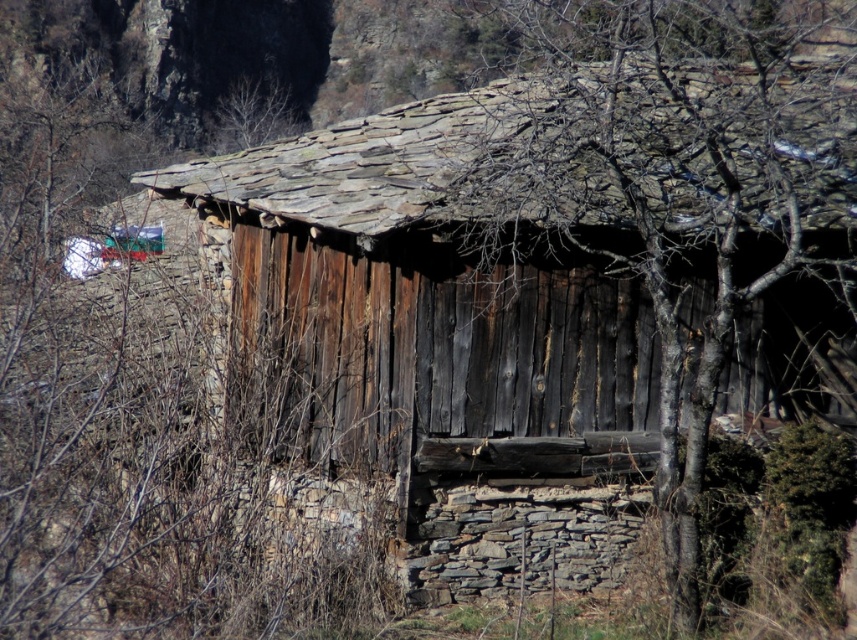
Who is more forward, (166,520) or (852,388)?

Point (166,520)

Which is above, brown rough bark tree at upper left or brown rough bark tree at center?

Positioned higher is brown rough bark tree at center.

Is point (211, 355) positioned after point (667, 145)?

Yes, point (211, 355) is farther from viewer.

Identify the location of brown rough bark tree at upper left. (135, 440).

Does brown rough bark tree at center have a larger size compared to bare branches at upper center?

Correct, brown rough bark tree at center is larger in size than bare branches at upper center.

Is brown rough bark tree at center taller than bare branches at upper center?

Correct, brown rough bark tree at center is much taller as bare branches at upper center.

Does point (519, 182) come closer to viewer compared to point (208, 150)?

That is True.

Where is `brown rough bark tree at center`? This screenshot has width=857, height=640. brown rough bark tree at center is located at coordinates (678, 186).

Is brown rough bark tree at upper left above bare branches at upper center?

Actually, brown rough bark tree at upper left is below bare branches at upper center.

Who is positioned more to the right, brown rough bark tree at upper left or bare branches at upper center?

bare branches at upper center

Is point (214, 554) less distant than point (280, 134)?

Yes, it is in front of point (280, 134).

At what (x,y) coordinates should I click in order to perform the action: click on brown rough bark tree at upper left. Please return your answer as a coordinate pair (x, y). This screenshot has height=640, width=857. Looking at the image, I should click on (135, 440).